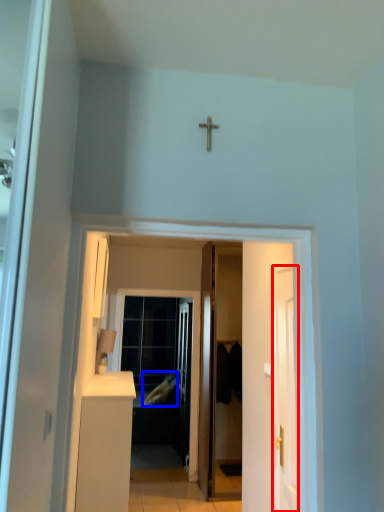
Question: Which object is further to the camera taking this photo, door (highlighted by a red box) or pillow (highlighted by a blue box)?

Choices:
 (A) door
 (B) pillow

Answer: (B)